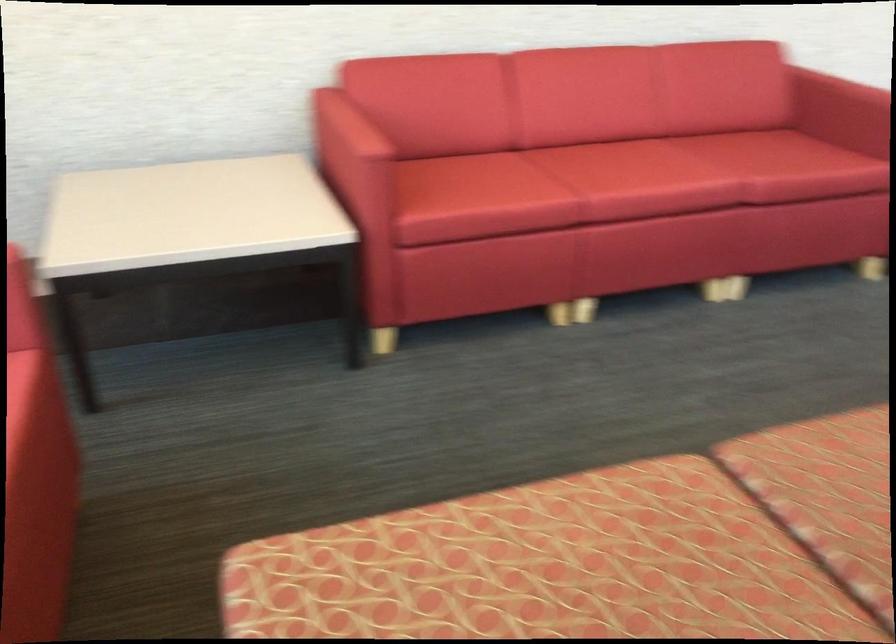
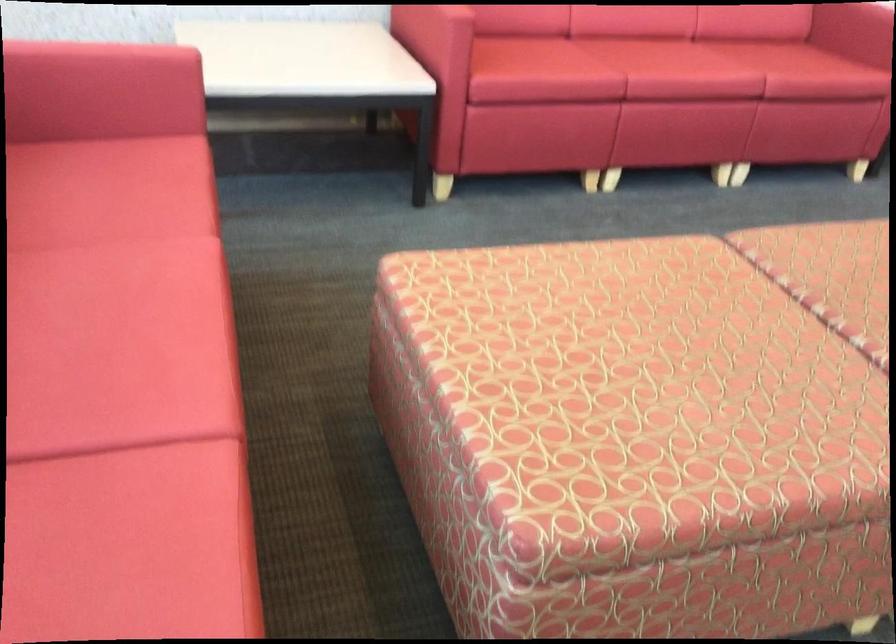
Question: The images are taken continuously from a first-person perspective. In which direction is your viewpoint rotating?

Choices:
 (A) Left
 (B) Right
 (C) Up
 (D) Down

Answer: (D)